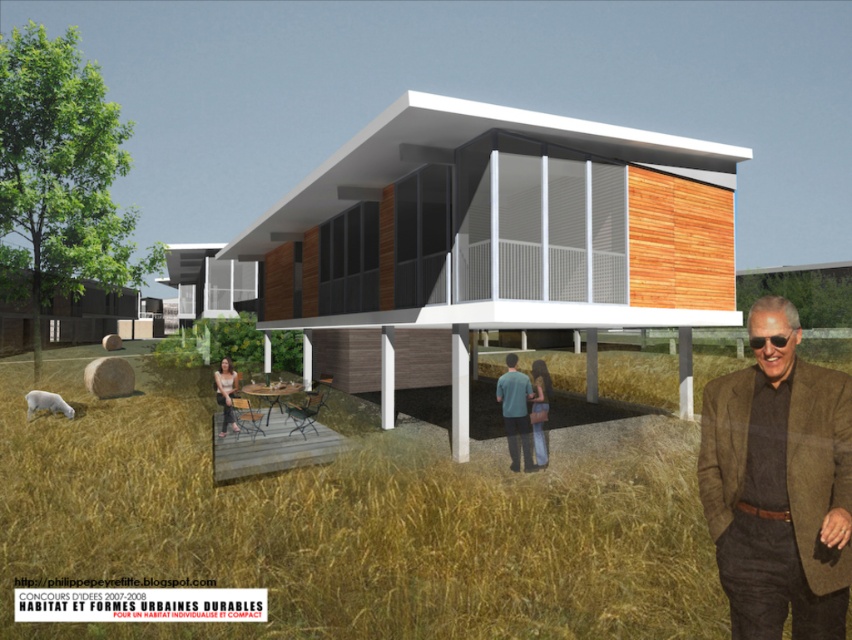
Does blue jeans at lower center come in front of matte brown hair at lower center?

Yes.

Is point (545, 456) positioned in front of point (235, 376)?

Yes, point (545, 456) is in front of point (235, 376).

Which is in front, point (542, 451) or point (233, 417)?

Point (542, 451) is in front.

Where is `blue jeans at lower center`? blue jeans at lower center is located at coordinates (540, 412).

Is teal fabric shirt at center to the right of blue jeans at lower center from the viewer's perspective?

Incorrect, teal fabric shirt at center is not on the right side of blue jeans at lower center.

Who is positioned more to the left, teal fabric shirt at center or blue jeans at lower center?

teal fabric shirt at center

This screenshot has width=852, height=640. Describe the element at coordinates (515, 412) in the screenshot. I see `teal fabric shirt at center` at that location.

The width and height of the screenshot is (852, 640). Find the location of `teal fabric shirt at center`. teal fabric shirt at center is located at coordinates (515, 412).

Does brown wool jacket at lower right have a smaller size compared to matte brown hair at lower center?

Incorrect, brown wool jacket at lower right is not smaller in size than matte brown hair at lower center.

Is brown wool jacket at lower right shorter than matte brown hair at lower center?

No.

Find the location of a particular element. The image size is (852, 640). brown wool jacket at lower right is located at coordinates (779, 483).